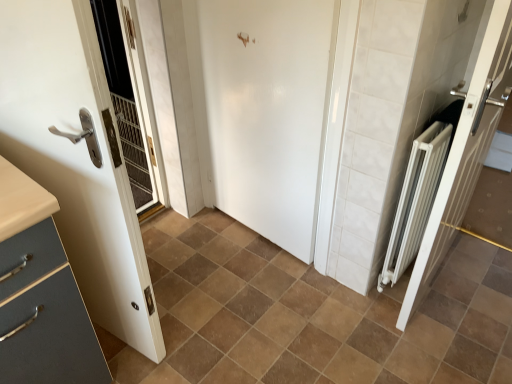
Question: From the image's perspective, is white glossy door at center, which is the second door from right to left, over brown matte tile at center?

Choices:
 (A) no
 (B) yes

Answer: (B)

Question: Is white glossy door at center, the 2th door in the left-to-right sequence, wider than brown matte tile at center?

Choices:
 (A) no
 (B) yes

Answer: (A)

Question: From the image's perspective, is white glossy door at center, which is the second door from right to left, beneath brown matte tile at center?

Choices:
 (A) no
 (B) yes

Answer: (A)

Question: From a real-world perspective, is white glossy door at center, which is the second door from right to left, on brown matte tile at center?

Choices:
 (A) no
 (B) yes

Answer: (B)

Question: Can you confirm if white glossy door at center, which is the second door from right to left, is positioned to the right of brown matte tile at center?

Choices:
 (A) no
 (B) yes

Answer: (A)

Question: Considering the relative positions of brown matte tile at center and white glossy door at left, the first door from the left, in the image provided, is brown matte tile at center to the left or to the right of white glossy door at left, the first door from the left,?

Choices:
 (A) right
 (B) left

Answer: (A)

Question: Based on their sizes in the image, would you say brown matte tile at center is bigger or smaller than white glossy door at left, the first door from the left?

Choices:
 (A) small
 (B) big

Answer: (A)

Question: From a real-world perspective, relative to white glossy door at left, the first door from the left, is brown matte tile at center vertically above or below?

Choices:
 (A) above
 (B) below

Answer: (B)

Question: From their relative heights in the image, would you say brown matte tile at center is taller or shorter than white glossy door at left, the first door from the left?

Choices:
 (A) tall
 (B) short

Answer: (B)

Question: Considering the positions of white metallic radiator at right, placed as the third door when sorted from left to right, and white glossy door at left, the 3th door in the right-to-left sequence, in the image, is white metallic radiator at right, placed as the third door when sorted from left to right, wider or thinner than white glossy door at left, the 3th door in the right-to-left sequence,?

Choices:
 (A) thin
 (B) wide

Answer: (A)

Question: In terms of size, does white metallic radiator at right, placed as the third door when sorted from left to right, appear bigger or smaller than white glossy door at left, the first door from the left?

Choices:
 (A) big
 (B) small

Answer: (B)

Question: Considering their positions, is white metallic radiator at right, the 1th door positioned from the right, located in front of or behind white glossy door at left, the 3th door in the right-to-left sequence?

Choices:
 (A) behind
 (B) front

Answer: (A)

Question: From a real-world perspective, is white metallic radiator at right, placed as the third door when sorted from left to right, positioned above or below white glossy door at left, the 3th door in the right-to-left sequence?

Choices:
 (A) above
 (B) below

Answer: (B)

Question: Considering the relative positions of white glossy door at left, the first door from the left, and white glossy door at center, the 2th door in the left-to-right sequence, in the image provided, is white glossy door at left, the first door from the left, to the left or to the right of white glossy door at center, the 2th door in the left-to-right sequence,?

Choices:
 (A) right
 (B) left

Answer: (B)

Question: Is white glossy door at left, the first door from the left, wider or thinner than white glossy door at center, which is the second door from right to left?

Choices:
 (A) wide
 (B) thin

Answer: (A)